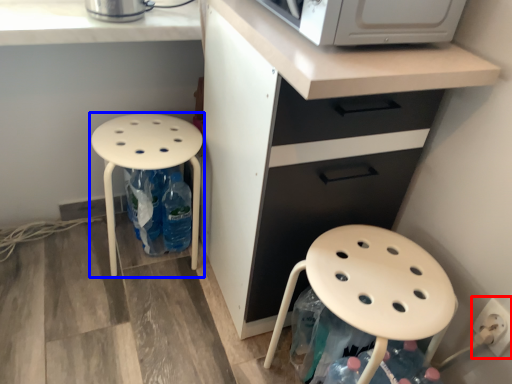
Question: Which point is further to the camera, electric outlet (highlighted by a red box) or stool (highlighted by a blue box)?

Choices:
 (A) electric outlet
 (B) stool

Answer: (B)